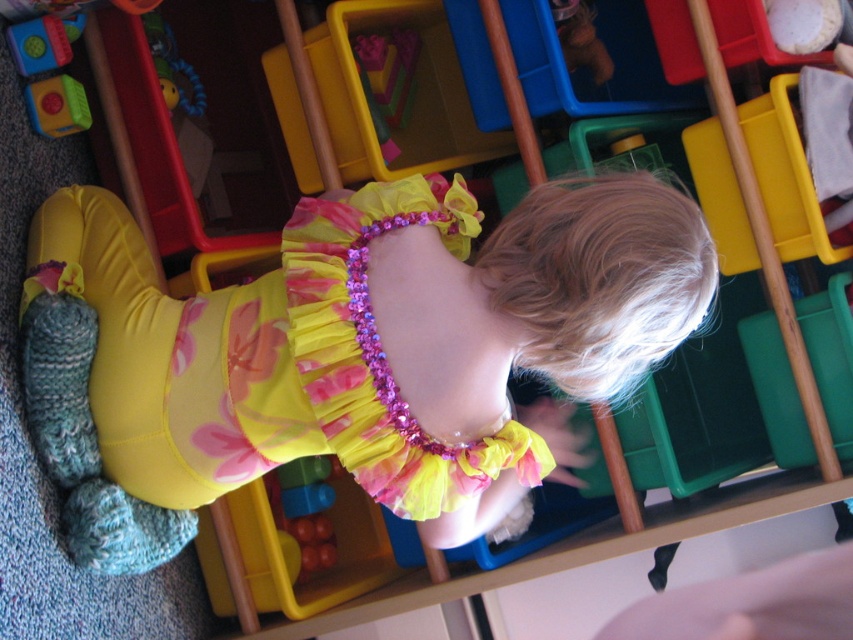
Which of these two, translucent plastic blocks at lower center or rubberized green toy at upper left, stands taller?

Standing taller between the two is translucent plastic blocks at lower center.

Which is above, translucent plastic blocks at lower center or rubberized green toy at upper left?

rubberized green toy at upper left is higher up.

Find the location of a particular element. translucent plastic blocks at lower center is located at coordinates (306, 509).

Identify the location of translucent plastic blocks at lower center. (306, 509).

Does yellow satin dress at center have a lesser height compared to rubberized green toy at upper left?

No, yellow satin dress at center is not shorter than rubberized green toy at upper left.

Does yellow satin dress at center have a lesser width compared to rubberized green toy at upper left?

No.

What do you see at coordinates (347, 353) in the screenshot? Image resolution: width=853 pixels, height=640 pixels. I see `yellow satin dress at center` at bounding box center [347, 353].

Find the location of a particular element. yellow satin dress at center is located at coordinates (347, 353).

Is yellow satin dress at center positioned at the back of translucent plastic blocks at lower center?

No, yellow satin dress at center is in front of translucent plastic blocks at lower center.

Does yellow satin dress at center have a smaller size compared to translucent plastic blocks at lower center?

Incorrect, yellow satin dress at center is not smaller in size than translucent plastic blocks at lower center.

This screenshot has width=853, height=640. In order to click on yellow satin dress at center in this screenshot , I will do `click(347, 353)`.

Locate an element on the screen. This screenshot has height=640, width=853. yellow satin dress at center is located at coordinates (347, 353).